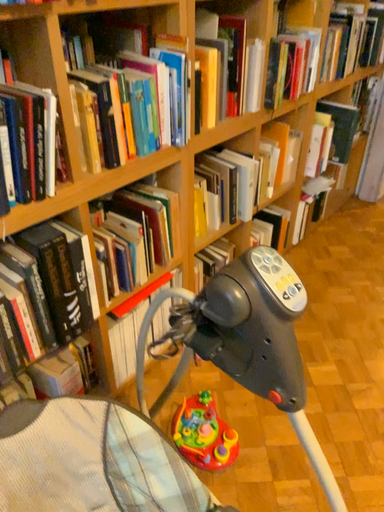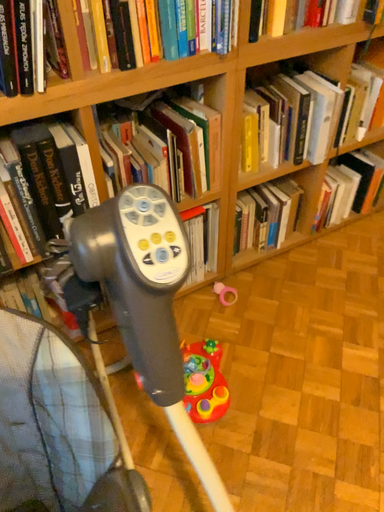
Question: Which way did the camera rotate in the video?

Choices:
 (A) rotated left
 (B) rotated right

Answer: (A)